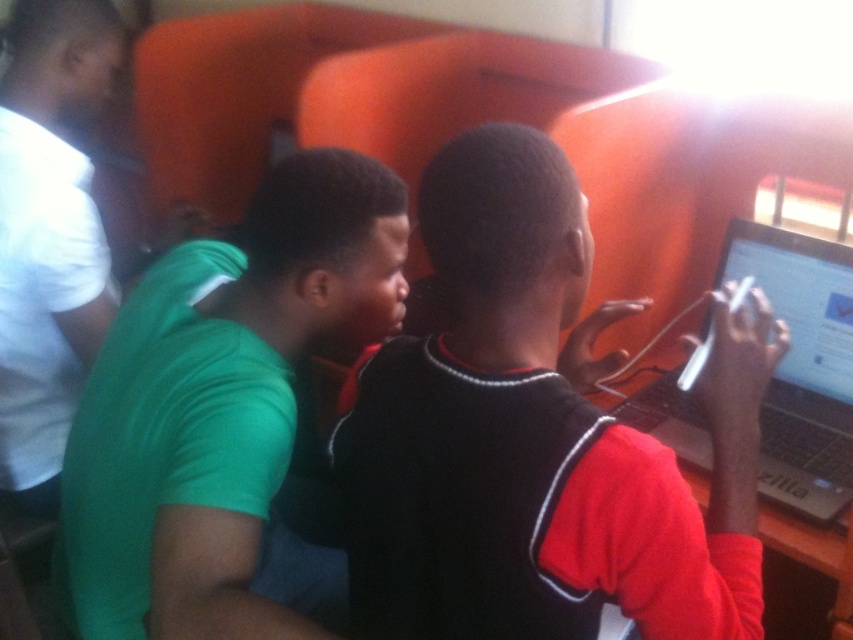
Between point (256, 464) and point (0, 330), which one is positioned behind?

The point (0, 330) is behind.

Does green matte shirt at center have a lesser height compared to white matte shirt at left?

Yes.

Between point (192, 417) and point (70, 262), which one is positioned behind?

Point (70, 262)

The height and width of the screenshot is (640, 853). Find the location of `green matte shirt at center`. green matte shirt at center is located at coordinates (219, 403).

From the picture: Is white matte shirt at left taller than silver/black laptop at right?

Correct, white matte shirt at left is much taller as silver/black laptop at right.

Does white matte shirt at left come in front of silver/black laptop at right?

No, white matte shirt at left is behind silver/black laptop at right.

Is point (51, 326) in front of point (802, 397)?

No.

Find the location of `white matte shirt at left`. white matte shirt at left is located at coordinates (49, 234).

Is point (402, 218) closer to camera compared to point (764, 442)?

Yes, point (402, 218) is closer to viewer.

Can you confirm if green matte shirt at center is shorter than silver/black laptop at right?

Incorrect, green matte shirt at center's height does not fall short of silver/black laptop at right's.

Who is more distant from viewer, (259, 516) or (844, 276)?

The point (844, 276) is more distant.

Identify the location of green matte shirt at center. (219, 403).